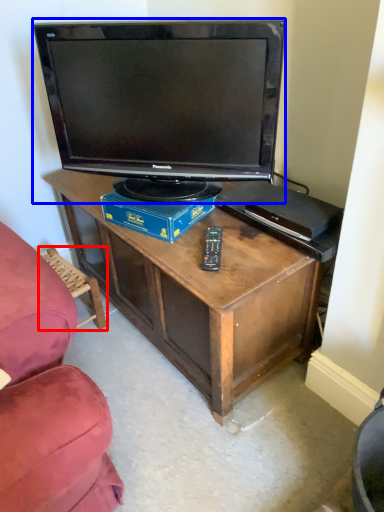
Question: Which object is closer to the camera taking this photo, swivel chair (highlighted by a red box) or television (highlighted by a blue box)?

Choices:
 (A) swivel chair
 (B) television

Answer: (B)